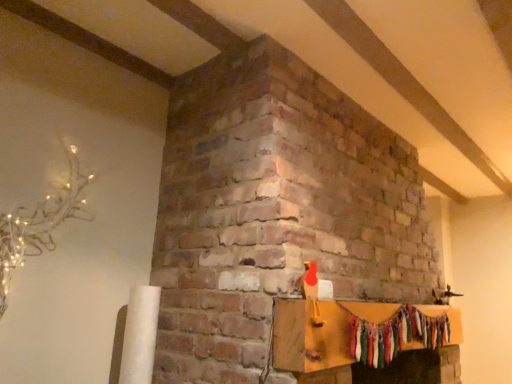
What are the coordinates of `wooden mantel at center` in the screenshot? It's located at (319, 332).

Describe the element at coordinates (319, 332) in the screenshot. The height and width of the screenshot is (384, 512). I see `wooden mantel at center` at that location.

What is the approximate height of wooden mantel at center?

It is 9.17 inches.

At what (x,y) coordinates should I click in order to perform the action: click on wooden mantel at center. Please return your answer as a coordinate pair (x, y). Looking at the image, I should click on (319, 332).